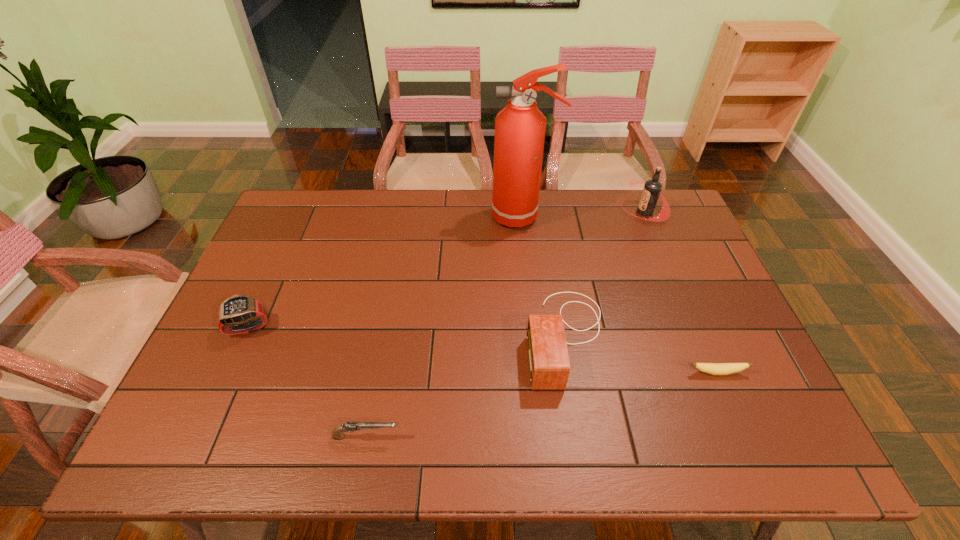
At what (x,y) coordinates should I click in order to perform the action: click on free space located on the label of the second tallest object. Please return your answer as a coordinate pair (x, y). Looking at the image, I should click on (570, 212).

Locate an element on the screen. The image size is (960, 540). free spot located on the label of the second tallest object is located at coordinates (556, 212).

This screenshot has height=540, width=960. Find the location of `free space located 0.100m on the label of the second tallest object`. free space located 0.100m on the label of the second tallest object is located at coordinates (593, 212).

Find the location of a particular element. This screenshot has height=540, width=960. vacant space located on the front-facing side of the radio receiver is located at coordinates (484, 338).

Locate an element on the screen. vacant region located on the front-facing side of the radio receiver is located at coordinates (480, 338).

Locate an element on the screen. The image size is (960, 540). free space located on the front-facing side of the radio receiver is located at coordinates (461, 338).

You are a GUI agent. You are given a task and a screenshot of the screen. Output one action in this format:
    pyautogui.click(x=<x>, y=<y>)
    Task: Click on the free space located 0.200m on the back of the watch
    The image size is (960, 540).
    Given the screenshot: What is the action you would take?
    click(x=277, y=264)

Identify the location of vacant region located aiming along the barrel of the gun. (563, 436).

Locate an element on the screen. The width and height of the screenshot is (960, 540). free space located 0.260m on the left of the banana is located at coordinates (581, 373).

The width and height of the screenshot is (960, 540). What are the coordinates of `fire extinguisher present at the far edge` in the screenshot? It's located at (520, 127).